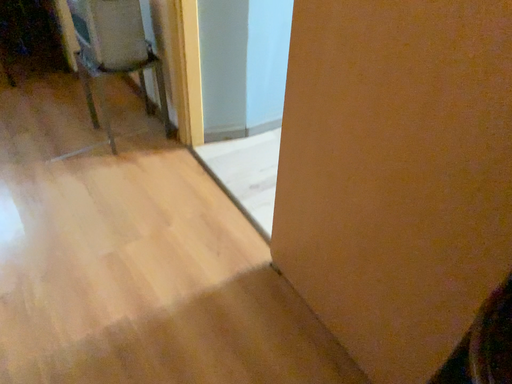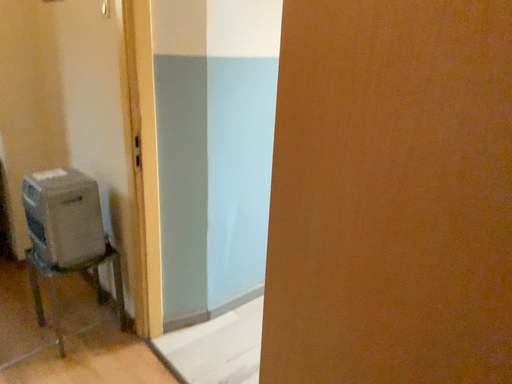
Question: How did the camera likely rotate when shooting the video?

Choices:
 (A) rotated right
 (B) rotated left

Answer: (A)